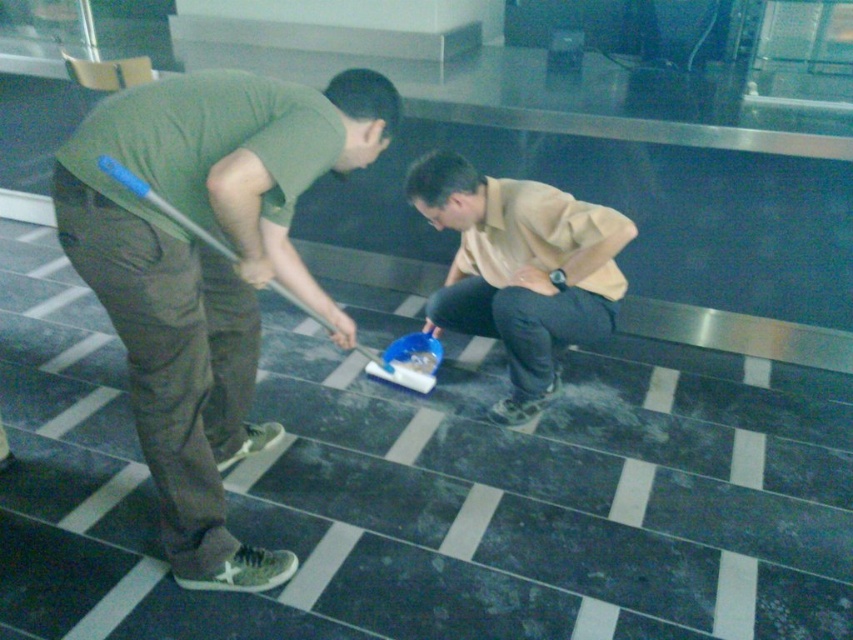
Which is in front, point (221, 522) or point (575, 289)?

Positioned in front is point (221, 522).

Does point (184, 417) lie behind point (451, 208)?

No, (184, 417) is closer to viewer.

Describe the element at coordinates (207, 272) in the screenshot. I see `green matte shirt at center` at that location.

Identify the location of green matte shirt at center. This screenshot has height=640, width=853. (207, 272).